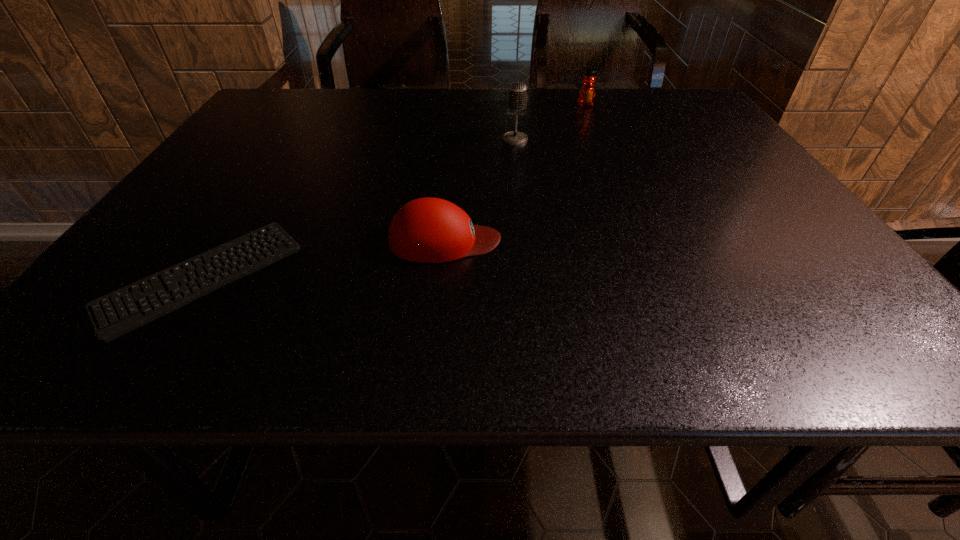
Image resolution: width=960 pixels, height=540 pixels. Identify the location of object that is the second nearest to the baseball cap. (517, 98).

Point out which object is positioned as the third nearest to the microphone. Please provide its 2D coordinates. Your answer should be formatted as a tuple, i.e. [(x, y)], where the tuple contains the x and y coordinates of a point satisfying the conditions above.

[(164, 297)]

Where is `free space that satisfies the following two spatial constraints: 1. on the front label of the rightmost object; 2. on the front-facing side of the baseball cap`? free space that satisfies the following two spatial constraints: 1. on the front label of the rightmost object; 2. on the front-facing side of the baseball cap is located at coordinates (641, 241).

This screenshot has width=960, height=540. What are the coordinates of `blank area in the image that satisfies the following two spatial constraints: 1. on the front label of the honey; 2. on the front-facing side of the second object from left to right` in the screenshot? It's located at (641, 241).